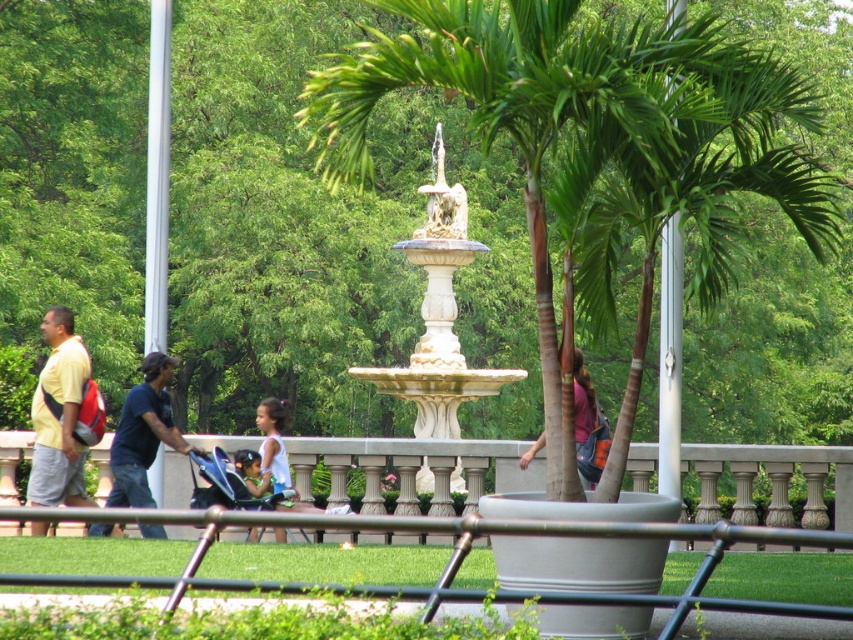
Question: From the image, what is the correct spatial relationship of dark blue t-shirt at center in relation to pink fabric purse at center?

Choices:
 (A) right
 (B) left

Answer: (B)

Question: Considering the real-world distances, which object is farthest from the yellow matte shirt at left?

Choices:
 (A) white stone fountain at center
 (B) green leafy tree at center

Answer: (B)

Question: Which object is positioned closest to the pink fabric purse at center?

Choices:
 (A) white fabric dress at center
 (B) green leafy tree at center

Answer: (A)

Question: Can you confirm if green leafy tree at center is thinner than white stone fountain at center?

Choices:
 (A) no
 (B) yes

Answer: (A)

Question: Estimate the real-world distances between objects in this image. Which object is farther from the dark blue t-shirt at center?

Choices:
 (A) pink fabric purse at center
 (B) yellow matte shirt at left
 (C) white fabric dress at center
 (D) white stone fountain at center

Answer: (A)

Question: Does white stone fountain at center appear under yellow matte shirt at left?

Choices:
 (A) no
 (B) yes

Answer: (A)